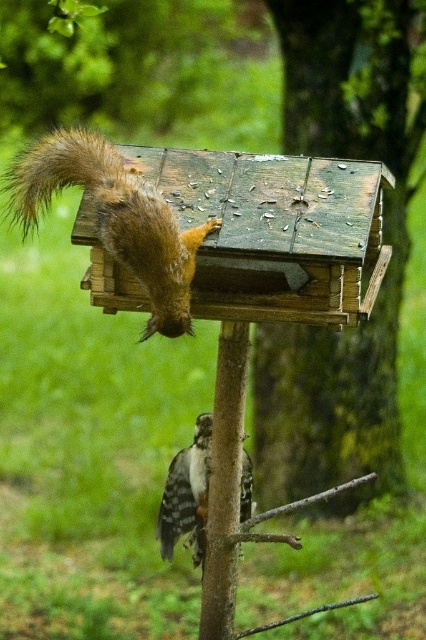
Question: Is brown furry squirrel at upper left thinner than speckled brown woodpecker at lower center?

Choices:
 (A) no
 (B) yes

Answer: (A)

Question: Which object appears closest to the camera in this image?

Choices:
 (A) brown furry squirrel at upper left
 (B) speckled brown woodpecker at lower center
 (C) weathered wood birdhouse at center

Answer: (A)

Question: Which is nearer to the speckled brown woodpecker at lower center?

Choices:
 (A) weathered wood birdhouse at center
 (B) brown furry squirrel at upper left

Answer: (B)

Question: Which object appears farthest from the camera in this image?

Choices:
 (A) brown furry squirrel at upper left
 (B) weathered wood birdhouse at center
 (C) speckled brown woodpecker at lower center

Answer: (B)

Question: Is brown furry squirrel at upper left closer to camera compared to speckled brown woodpecker at lower center?

Choices:
 (A) no
 (B) yes

Answer: (B)

Question: Is weathered wood birdhouse at center above brown furry squirrel at upper left?

Choices:
 (A) yes
 (B) no

Answer: (A)